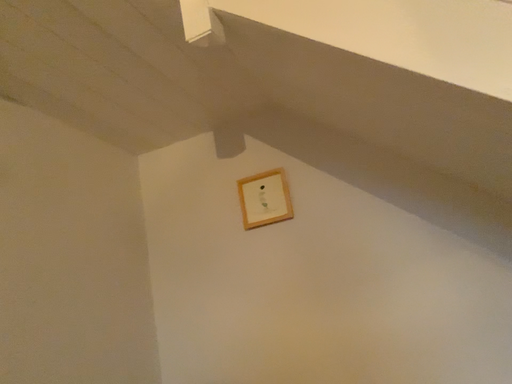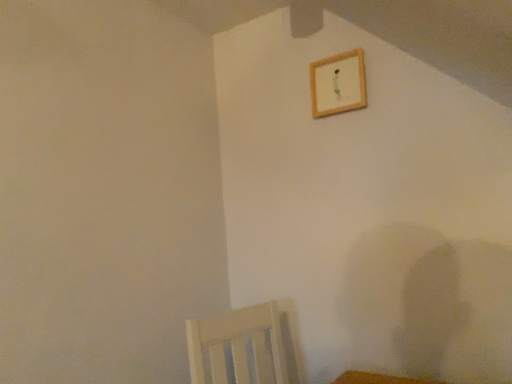
Question: How did the camera likely rotate when shooting the video?

Choices:
 (A) rotated right
 (B) rotated left

Answer: (B)